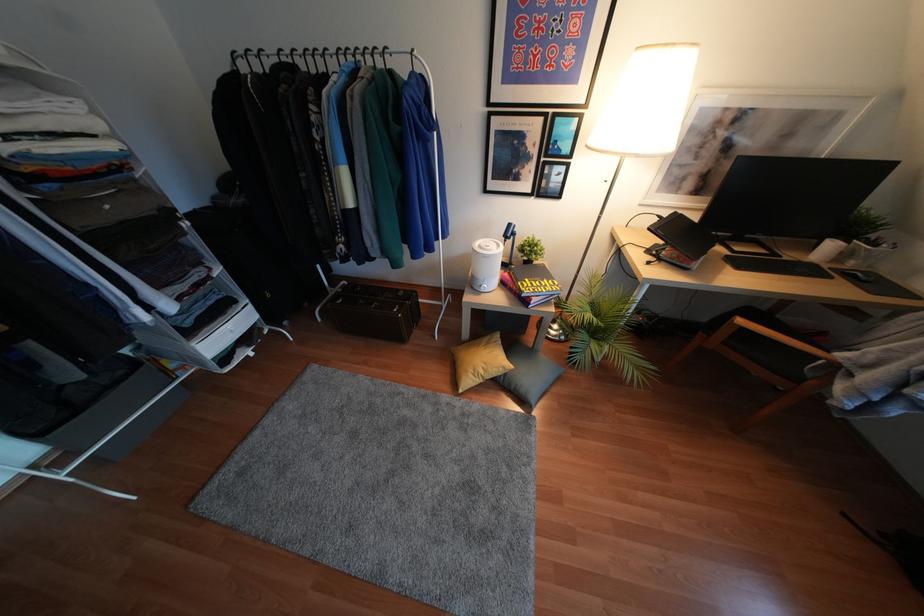
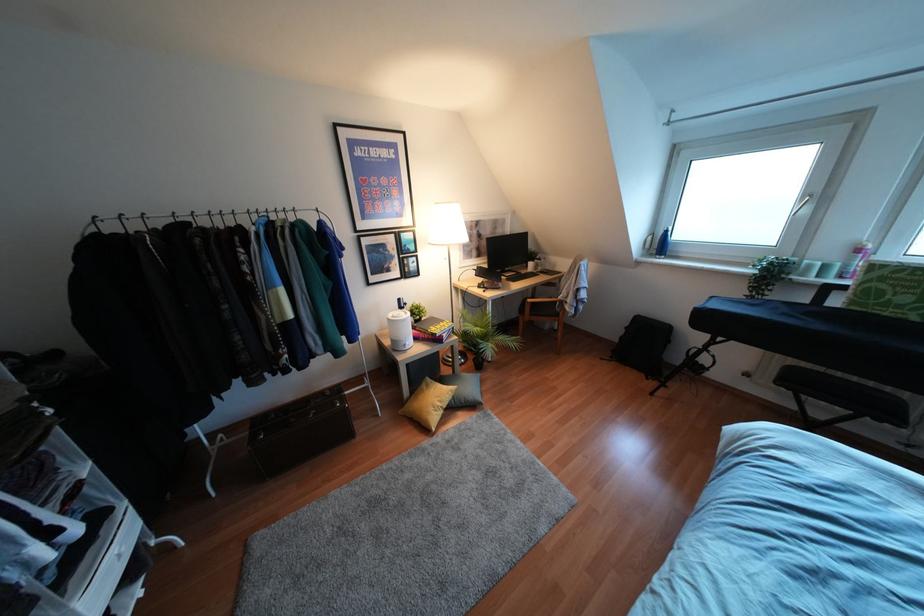
In the second image, find the point that corresponds to (x=481, y=290) in the first image.

(407, 347)